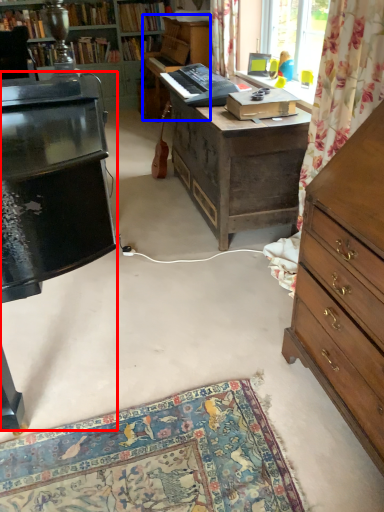
Question: Which of the following is the farthest to the observer, piano (highlighted by a red box) or piano (highlighted by a blue box)?

Choices:
 (A) piano
 (B) piano

Answer: (B)